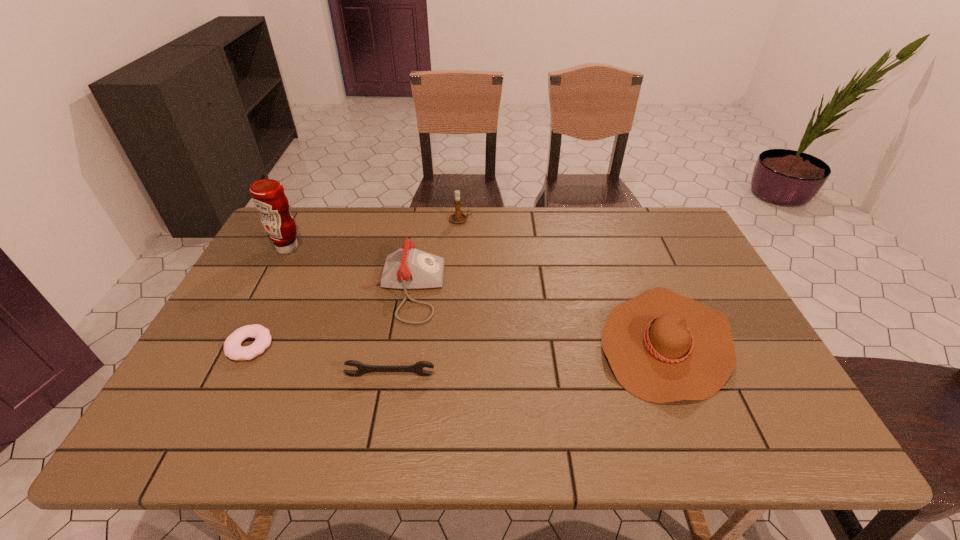
Find the location of a particular element. This screenshot has width=960, height=540. vacant space located on the side of the farthest object with the handle is located at coordinates (487, 220).

Where is `free space located on the dial of the telephone`? The height and width of the screenshot is (540, 960). free space located on the dial of the telephone is located at coordinates 520,289.

This screenshot has height=540, width=960. In order to click on vacant region located on the left of the third shortest object in this screenshot , I will do `click(447, 343)`.

The height and width of the screenshot is (540, 960). In order to click on free region located 0.050m on the open ends of the second shortest object in this screenshot , I will do `click(386, 395)`.

The width and height of the screenshot is (960, 540). Identify the location of vacant position located 0.110m on the back of the shortest object. (273, 299).

The width and height of the screenshot is (960, 540). What are the coordinates of `condiment that is at the far edge` in the screenshot? It's located at (268, 196).

At what (x,y) coordinates should I click in order to perform the action: click on candle holder that is at the far edge. Please return your answer as a coordinate pair (x, y). Looking at the image, I should click on (457, 217).

At what (x,y) coordinates should I click in order to perform the action: click on condiment positioned at the left edge. Please return your answer as a coordinate pair (x, y). Looking at the image, I should click on (268, 196).

Locate an element on the screen. The width and height of the screenshot is (960, 540). doughnut located at the left edge is located at coordinates (232, 346).

Where is `object that is positioned at the right edge`? object that is positioned at the right edge is located at coordinates (662, 347).